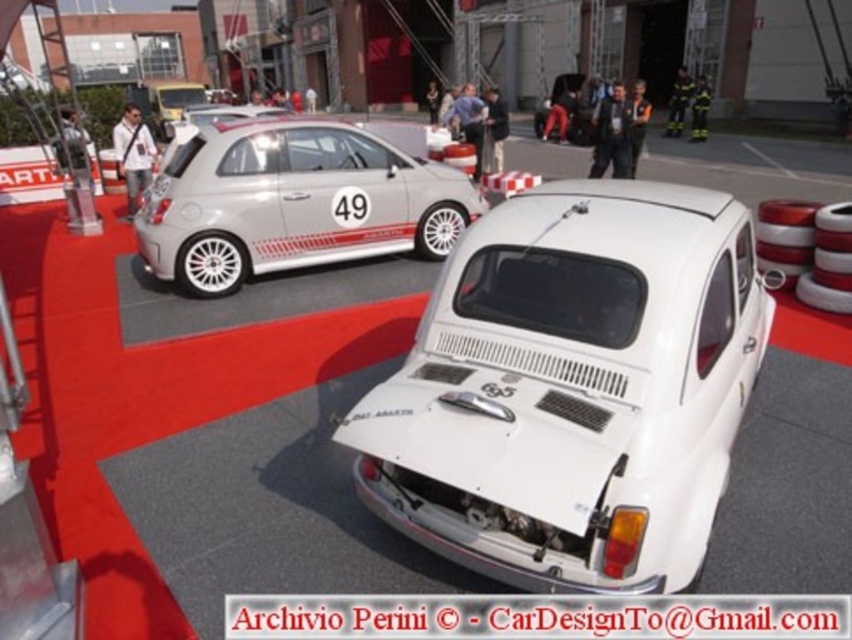
Describe the element at coordinates (285, 202) in the screenshot. I see `silver metallic hatchback at upper left` at that location.

Does silver metallic hatchback at upper left appear on the left side of white rubber tire at rear?

In fact, silver metallic hatchback at upper left is to the right of white rubber tire at rear.

Who is more distant from viewer, (x=390, y=228) or (x=181, y=282)?

The point (x=390, y=228) is behind.

At what (x,y) coordinates should I click in order to perform the action: click on silver metallic hatchback at upper left. Please return your answer as a coordinate pair (x, y). Looking at the image, I should click on (285, 202).

Can you confirm if white matte car at center is wider than white rubber tire at center?

Correct, the width of white matte car at center exceeds that of white rubber tire at center.

Which is behind, point (591, 432) or point (435, 209)?

The point (435, 209) is more distant.

I want to click on white matte car at center, so click(x=573, y=388).

Describe the element at coordinates (211, 264) in the screenshot. I see `white rubber tire at rear` at that location.

Which is in front, point (231, 268) or point (436, 237)?

Point (231, 268) is more forward.

Identify the location of white rubber tire at rear. The width and height of the screenshot is (852, 640). (211, 264).